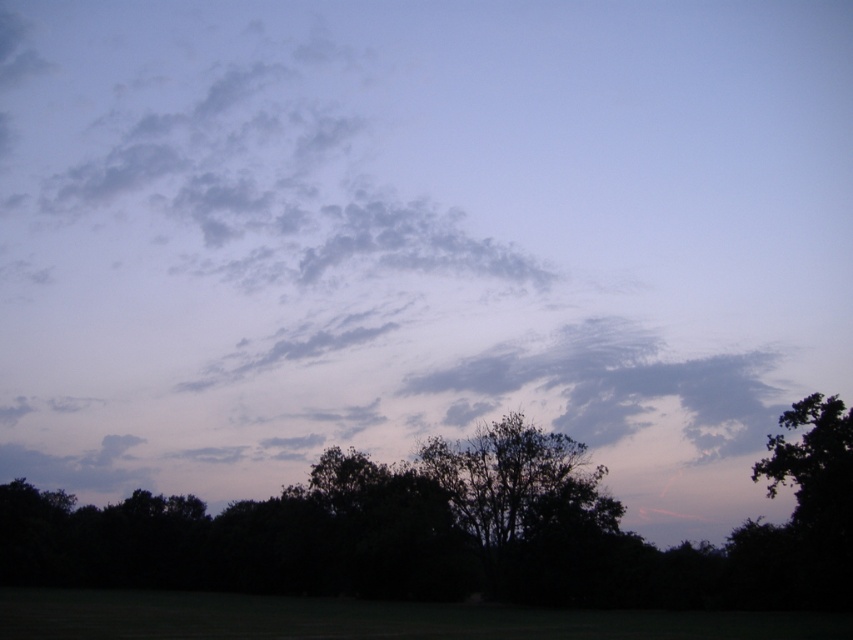
Is silhouette tree at lower center in front of silhouette leafy tree at center?

Yes, it is in front of silhouette leafy tree at center.

Is point (828, 452) in front of point (595, 483)?

Yes.

Who is more forward, (502, 522) or (476, 540)?

Positioned in front is point (502, 522).

Where is `silhouette tree at lower center`? silhouette tree at lower center is located at coordinates (454, 532).